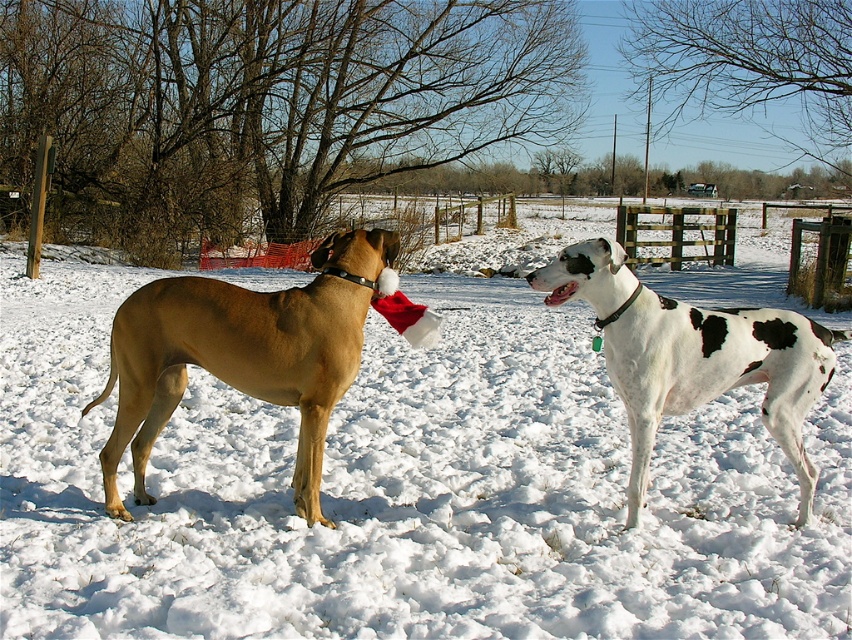
Which is in front, point (714, 419) or point (257, 323)?

Point (257, 323)

Who is more distant from viewer, [223,580] or [171,365]?

Positioned behind is point [171,365].

Image resolution: width=852 pixels, height=640 pixels. Find the location of `white fluffy snow at center`. white fluffy snow at center is located at coordinates (406, 490).

The image size is (852, 640). Describe the element at coordinates (406, 490) in the screenshot. I see `white fluffy snow at center` at that location.

Can you confirm if white fluffy snow at center is shorter than white-spotted fur at center?

No.

Measure the distance between point (x=465, y=468) and camera.

Point (x=465, y=468) and camera are 18.15 feet apart.

Locate an element on the screen. white fluffy snow at center is located at coordinates (406, 490).

The image size is (852, 640). What do you see at coordinates (242, 355) in the screenshot?
I see `golden fur coat at left` at bounding box center [242, 355].

Consider the image. Between golden fur coat at left and white-spotted fur at center, which one appears on the right side from the viewer's perspective?

white-spotted fur at center

This screenshot has width=852, height=640. Find the location of `golden fur coat at left`. golden fur coat at left is located at coordinates (242, 355).